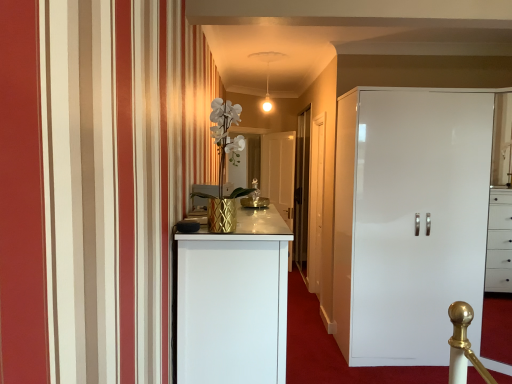
Question: Looking at their shapes, would you say white textured vase at center is wider or thinner than white glossy cupboard at right?

Choices:
 (A) wide
 (B) thin

Answer: (B)

Question: From the image's perspective, is white textured vase at center located above or below white glossy cupboard at right?

Choices:
 (A) below
 (B) above

Answer: (B)

Question: Which object is positioned closest to the white glossy cupboard at right?

Choices:
 (A) transparent glass door at center
 (B) white wooden door at center, which is the second door in left-to-right order
 (C) white textured vase at center
 (D) white glossy door at center, the first door in the left-to-right sequence

Answer: (B)

Question: Which of these objects is positioned farthest from the transparent glass door at center?

Choices:
 (A) white textured vase at center
 (B) white wooden door at center, the 1th door positioned from the front
 (C) white glossy door at center, the first door in the left-to-right sequence
 (D) white glossy cupboard at right

Answer: (A)